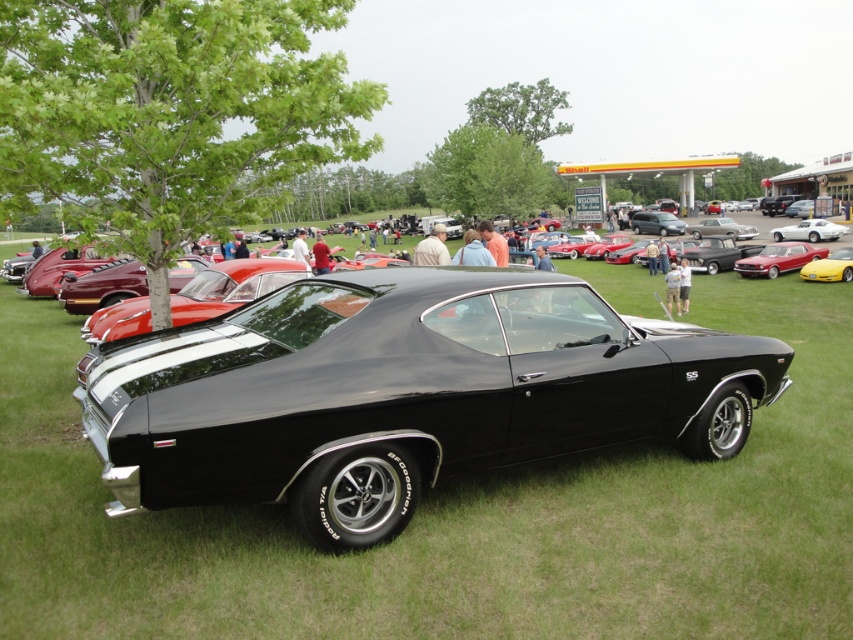
Between shiny red car at center right and white glossy sedan at right, which one is positioned higher?

white glossy sedan at right is higher up.

Locate an element on the screen. shiny red car at center right is located at coordinates (778, 259).

Image resolution: width=853 pixels, height=640 pixels. In order to click on shiny red car at center right in this screenshot , I will do `click(778, 259)`.

Is yellow matte sports car at center to the left of shiny silver sedan at center from the viewer's perspective?

Correct, you'll find yellow matte sports car at center to the left of shiny silver sedan at center.

Which is in front, point (804, 273) or point (744, 232)?

Point (804, 273)

What do you see at coordinates (830, 266) in the screenshot? I see `yellow matte sports car at center` at bounding box center [830, 266].

Find the location of a particular element. Image resolution: width=853 pixels, height=640 pixels. yellow matte sports car at center is located at coordinates (830, 266).

Who is taller, black glossy car at center or shiny silver sedan at center?

With more height is shiny silver sedan at center.

Is black glossy car at center positioned at the back of shiny silver sedan at center?

No, it is in front of shiny silver sedan at center.

You are a GUI agent. You are given a task and a screenshot of the screen. Output one action in this format:
    pyautogui.click(x=<x>, y=<y>)
    Task: Click on the black glossy car at center
    The height and width of the screenshot is (640, 853).
    Given the screenshot: What is the action you would take?
    pyautogui.click(x=405, y=394)